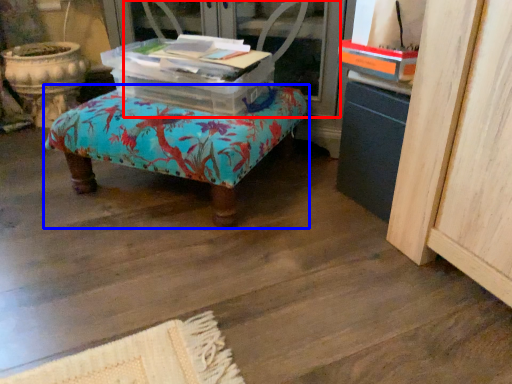
Question: Among these objects, which one is farthest to the camera, screen door (highlighted by a red box) or furniture (highlighted by a blue box)?

Choices:
 (A) screen door
 (B) furniture

Answer: (A)